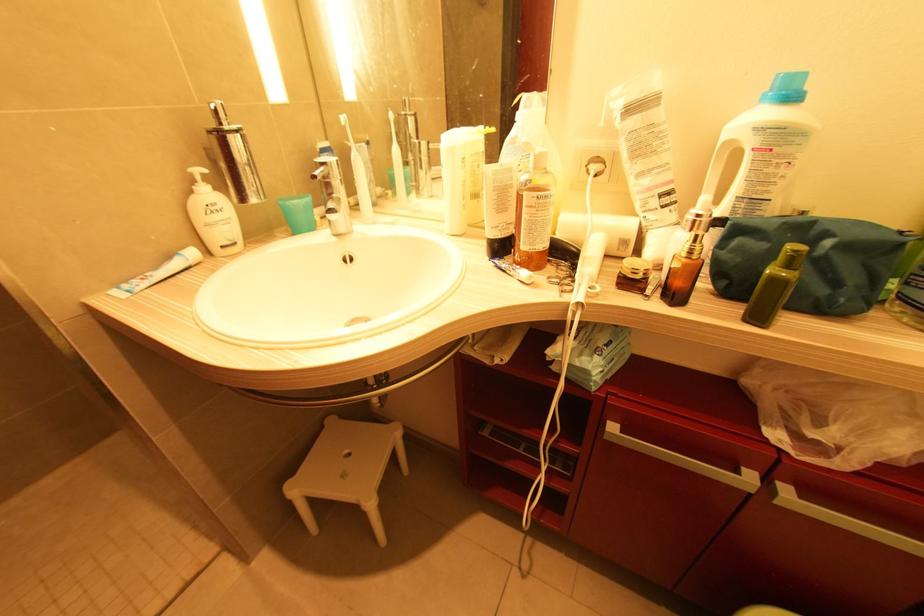
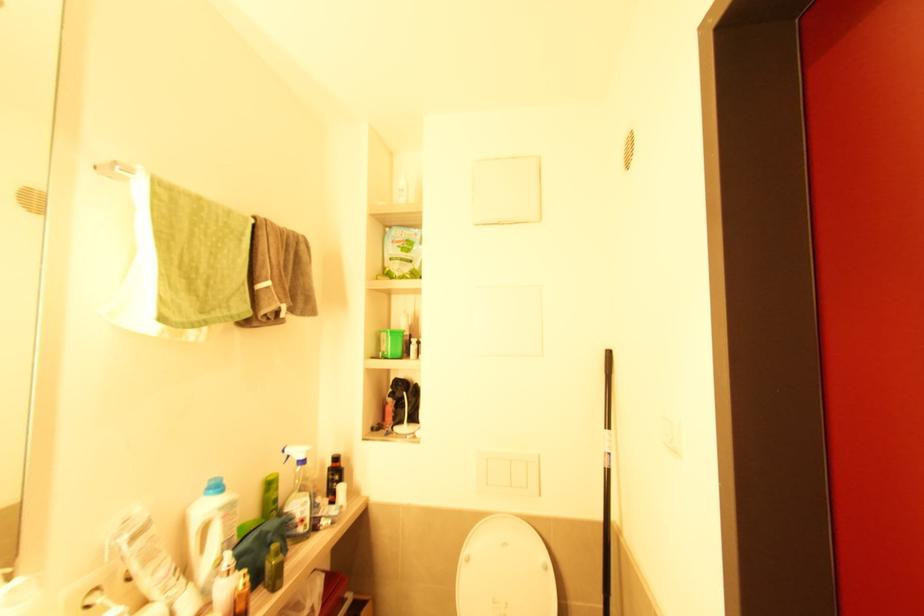
In the second image, find the point that corresponds to [755,150] in the first image.

(224, 519)